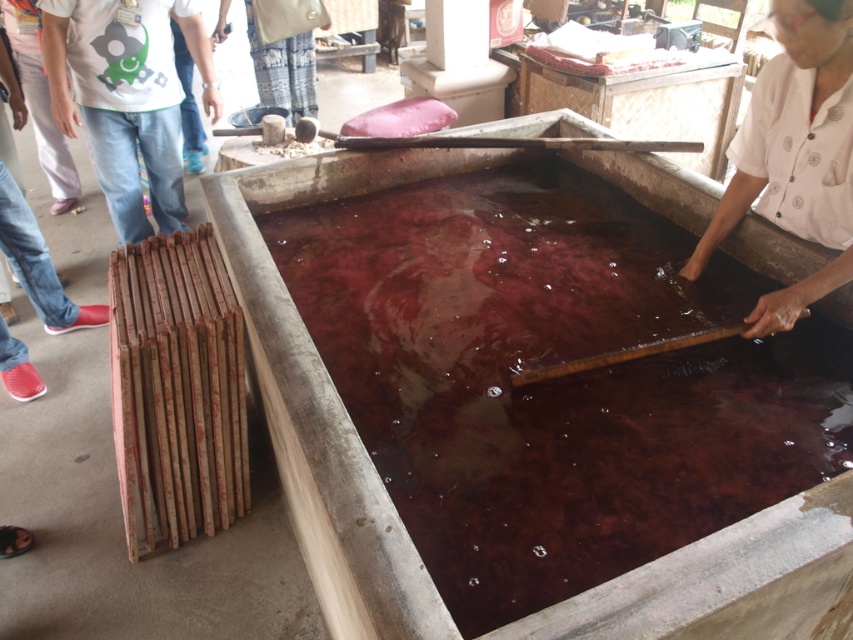
Which is below, brown translucent water at center or white cotton shirt at upper left?

brown translucent water at center is lower down.

Is point (416, 356) less distant than point (96, 93)?

Yes, it is.

Which is in front, point (671, 292) or point (112, 205)?

Point (671, 292) is in front.

This screenshot has width=853, height=640. Find the location of `brown translucent water at center`. brown translucent water at center is located at coordinates (553, 378).

Between brown translucent water at center and white dotted shirt at upper right, which one has more height?

Standing taller between the two is brown translucent water at center.

Is brown translucent water at center below white dotted shirt at upper right?

Yes, brown translucent water at center is below white dotted shirt at upper right.

The image size is (853, 640). What do you see at coordinates (553, 378) in the screenshot?
I see `brown translucent water at center` at bounding box center [553, 378].

Locate an element on the screen. brown translucent water at center is located at coordinates (553, 378).

Can you confirm if white dotted shirt at upper right is thinner than white cotton shirt at upper left?

Yes.

Looking at this image, does white dotted shirt at upper right have a larger size compared to white cotton shirt at upper left?

Actually, white dotted shirt at upper right might be smaller than white cotton shirt at upper left.

Is point (811, 115) positioned after point (161, 108)?

No.

The height and width of the screenshot is (640, 853). In order to click on white dotted shirt at upper right in this screenshot , I will do `click(795, 156)`.